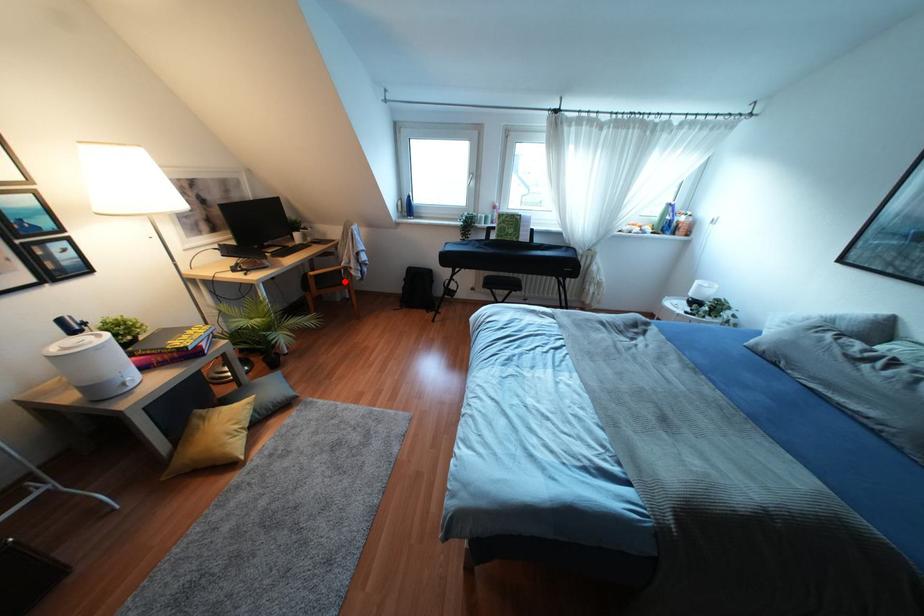
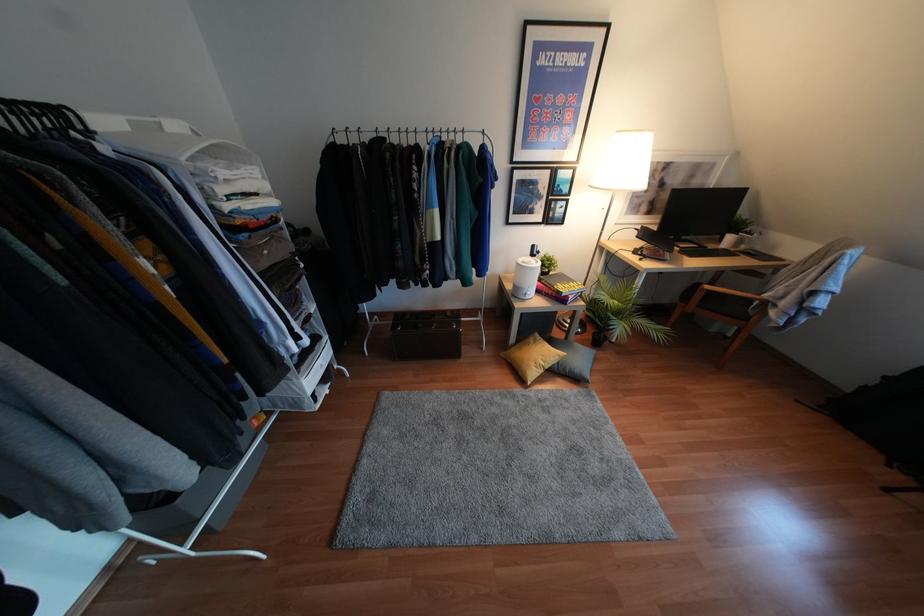
In the second image, find the point that corresponds to the highlighted location in the first image.

(745, 318)